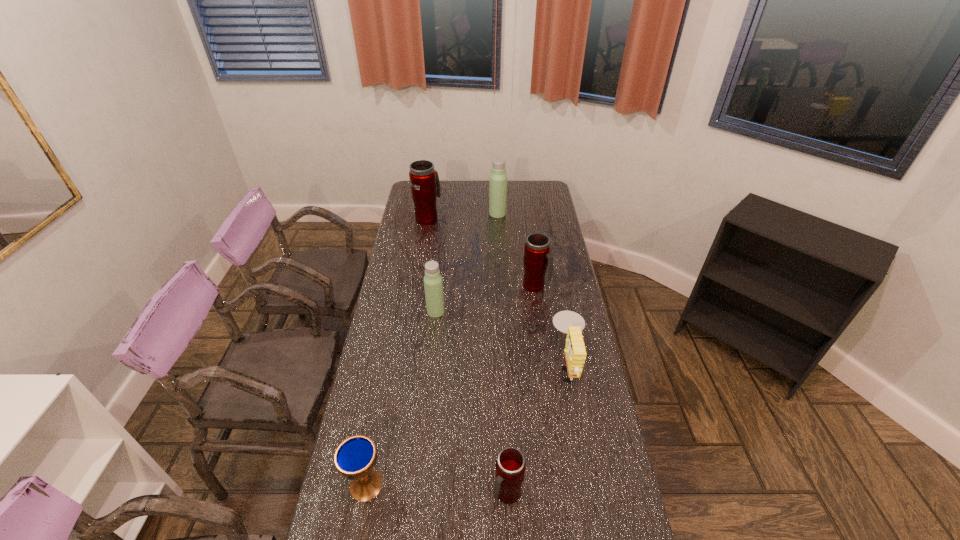
You are a GUI agent. You are given a task and a screenshot of the screen. Output one action in this format:
    pyautogui.click(x=<x>, y=<y>)
    Task: Click on the smallest red thermos bottle
    This screenshot has width=960, height=540.
    Given the screenshot: What is the action you would take?
    pyautogui.click(x=510, y=464)

Where is `the shortest thermos bottle`? This screenshot has width=960, height=540. the shortest thermos bottle is located at coordinates (510, 464).

Locate an element on the screen. blue chalice is located at coordinates (355, 457).

Locate an element on the screen. The width and height of the screenshot is (960, 540). free space located 0.270m on the side with the handle of the leftmost red thermos bottle is located at coordinates (433, 185).

Where is `vacant area situated 0.300m on the side with the handle of the leftmost red thermos bottle`? vacant area situated 0.300m on the side with the handle of the leftmost red thermos bottle is located at coordinates (434, 182).

Where is `vacant space located on the side with the handle of the leftmost red thermos bottle`? vacant space located on the side with the handle of the leftmost red thermos bottle is located at coordinates (430, 204).

At what (x,y) coordinates should I click in order to perform the action: click on blank space located 0.110m on the right of the farther light thermos bottle. Please return your answer as a coordinate pair (x, y). Image resolution: width=960 pixels, height=540 pixels. Looking at the image, I should click on (527, 213).

Locate an element on the screen. free point located on the back of the smaller light thermos bottle is located at coordinates (443, 249).

This screenshot has height=540, width=960. I want to click on free space located 0.120m on the front-facing side of the sponge, so click(518, 366).

Find the location of a particular element. This screenshot has width=960, height=540. vacant region located 0.310m on the front-facing side of the sponge is located at coordinates (465, 366).